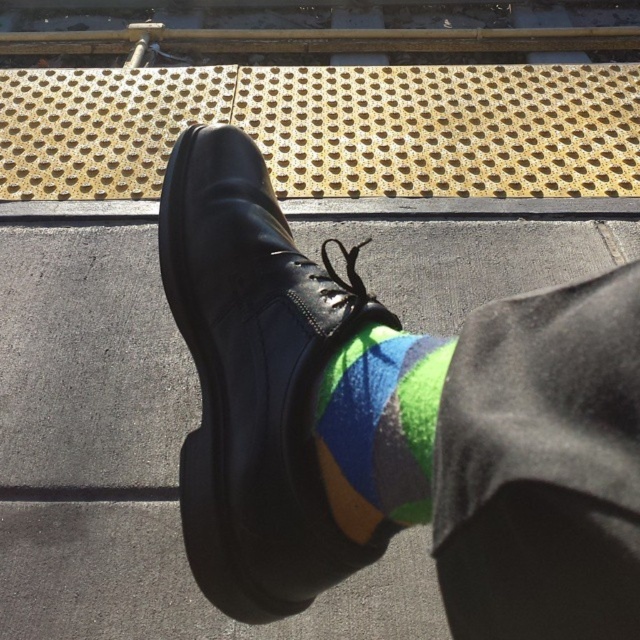
Which is below, black leather shoe at center or multicolored felt sock at center?

multicolored felt sock at center is lower down.

Does black leather shoe at center have a greater width compared to multicolored felt sock at center?

Yes, black leather shoe at center is wider than multicolored felt sock at center.

Is point (234, 346) positioned after point (380, 433)?

That is True.

Where is `black leather shoe at center`? The height and width of the screenshot is (640, 640). black leather shoe at center is located at coordinates (253, 380).